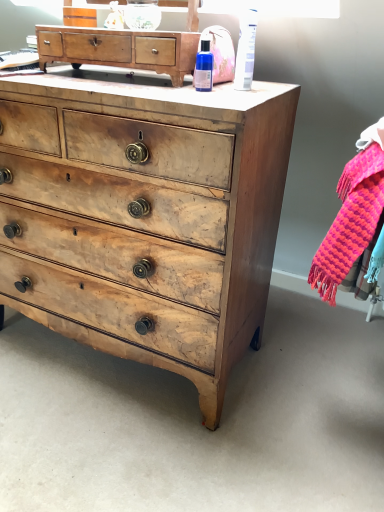
Image resolution: width=384 pixels, height=512 pixels. Find the location of `wooden chest of drawers at center, which is the 2th chest of drawers from top to bottom`. wooden chest of drawers at center, which is the 2th chest of drawers from top to bottom is located at coordinates (144, 217).

At what (x,y) coordinates should I click in order to perform the action: click on white plastic tube at upper right, arranged as the 2th toiletry when viewed from the left. Please return your answer as a coordinate pair (x, y). Looking at the image, I should click on (246, 50).

From the picture: Can you confirm if knitted wool scarf at right is thinner than white plastic tube at upper right, arranged as the 2th toiletry when viewed from the left?

Incorrect, the width of knitted wool scarf at right is not less than that of white plastic tube at upper right, arranged as the 2th toiletry when viewed from the left.

Does point (376, 179) come behind point (251, 35)?

No, it is not.

Is knitted wool scarf at right taller or shorter than white plastic tube at upper right, the first toiletry positioned from the right?

Clearly, knitted wool scarf at right is taller compared to white plastic tube at upper right, the first toiletry positioned from the right.

Is knitted wool scarf at right closer to the viewer compared to white plastic tube at upper right, arranged as the 2th toiletry when viewed from the left?

Yes, it is in front of white plastic tube at upper right, arranged as the 2th toiletry when viewed from the left.

From a real-world perspective, is blue glass bottle at upper center, which ranks as the 1th toiletry in left-to-right order, positioned over white plastic tube at upper right, the first toiletry positioned from the right, based on gravity?

Incorrect, from a real-world perspective, blue glass bottle at upper center, which ranks as the 1th toiletry in left-to-right order, is lower than white plastic tube at upper right, the first toiletry positioned from the right.

Could you tell me if blue glass bottle at upper center, which ranks as the 1th toiletry in left-to-right order, is turned towards white plastic tube at upper right, arranged as the 2th toiletry when viewed from the left?

No, blue glass bottle at upper center, which ranks as the 1th toiletry in left-to-right order, is not turned towards white plastic tube at upper right, arranged as the 2th toiletry when viewed from the left.

Is blue glass bottle at upper center, which ranks as the 1th toiletry in left-to-right order, not within white plastic tube at upper right, arranged as the 2th toiletry when viewed from the left?

Absolutely, blue glass bottle at upper center, which ranks as the 1th toiletry in left-to-right order, is external to white plastic tube at upper right, arranged as the 2th toiletry when viewed from the left.

Which of these two, knitted wool scarf at right or wooden chest of drawers at center, the 1th chest of drawers when ordered from bottom to top, is wider?

With larger width is wooden chest of drawers at center, the 1th chest of drawers when ordered from bottom to top.

Between point (369, 229) and point (114, 319), which one is positioned behind?

The point (114, 319) is farther from the camera.

You are a GUI agent. You are given a task and a screenshot of the screen. Output one action in this format:
    pyautogui.click(x=<x>, y=<y>)
    Task: Click on the clothing lying below the wooden chest of drawers at center, the 1th chest of drawers when ordered from bottom to top (from the image's perspective)
    The image size is (384, 512).
    Given the screenshot: What is the action you would take?
    pyautogui.click(x=350, y=221)

In terms of size, does knitted wool scarf at right appear bigger or smaller than wooden chest of drawers at center, which is the 2th chest of drawers from top to bottom?

In the image, knitted wool scarf at right appears to be smaller than wooden chest of drawers at center, which is the 2th chest of drawers from top to bottom.

Is wooden chest of drawers at upper center, the second chest of drawers from the bottom, beside white plastic tube at upper right, arranged as the 2th toiletry when viewed from the left?

No, wooden chest of drawers at upper center, the second chest of drawers from the bottom, is not in contact with white plastic tube at upper right, arranged as the 2th toiletry when viewed from the left.

Looking at their sizes, would you say wooden chest of drawers at upper center, which is counted as the first chest of drawers, starting from the top, is wider or thinner than white plastic tube at upper right, the first toiletry positioned from the right?

Clearly, wooden chest of drawers at upper center, which is counted as the first chest of drawers, starting from the top, has more width compared to white plastic tube at upper right, the first toiletry positioned from the right.

Between point (57, 28) and point (241, 86), which one is positioned behind?

Positioned behind is point (57, 28).

Can you confirm if knitted wool scarf at right is smaller than wooden chest of drawers at upper center, the second chest of drawers from the bottom?

Actually, knitted wool scarf at right might be larger than wooden chest of drawers at upper center, the second chest of drawers from the bottom.

Which object is thinner, knitted wool scarf at right or wooden chest of drawers at upper center, which is counted as the first chest of drawers, starting from the top?

With smaller width is wooden chest of drawers at upper center, which is counted as the first chest of drawers, starting from the top.

From the knitted wool scarf at right, count the 1st chest of drawers to the left and point to it. Please provide its 2D coordinates.

[(120, 49)]

From a real-world perspective, is wooden chest of drawers at center, the 1th chest of drawers when ordered from bottom to top, above or below blue glass bottle at upper center, which ranks as the 1th toiletry in left-to-right order?

wooden chest of drawers at center, the 1th chest of drawers when ordered from bottom to top, is below blue glass bottle at upper center, which ranks as the 1th toiletry in left-to-right order.

Which is behind, wooden chest of drawers at center, the 1th chest of drawers when ordered from bottom to top, or blue glass bottle at upper center, acting as the 2th toiletry starting from the right?

blue glass bottle at upper center, acting as the 2th toiletry starting from the right, is behind.

Looking at this image, is wooden chest of drawers at center, which is the 2th chest of drawers from top to bottom, positioned with its back to blue glass bottle at upper center, acting as the 2th toiletry starting from the right?

That's not correct — wooden chest of drawers at center, which is the 2th chest of drawers from top to bottom, is not looking away from blue glass bottle at upper center, acting as the 2th toiletry starting from the right.

In terms of height, does wooden chest of drawers at center, which is the 2th chest of drawers from top to bottom, look taller or shorter compared to blue glass bottle at upper center, which ranks as the 1th toiletry in left-to-right order?

wooden chest of drawers at center, which is the 2th chest of drawers from top to bottom, is taller than blue glass bottle at upper center, which ranks as the 1th toiletry in left-to-right order.

Is white plastic tube at upper right, arranged as the 2th toiletry when viewed from the left, inside or outside of blue glass bottle at upper center, acting as the 2th toiletry starting from the right?

white plastic tube at upper right, arranged as the 2th toiletry when viewed from the left, is spatially situated outside blue glass bottle at upper center, acting as the 2th toiletry starting from the right.

Based on the photo, can you confirm if white plastic tube at upper right, arranged as the 2th toiletry when viewed from the left, is smaller than blue glass bottle at upper center, which ranks as the 1th toiletry in left-to-right order?

No, white plastic tube at upper right, arranged as the 2th toiletry when viewed from the left, is not smaller than blue glass bottle at upper center, which ranks as the 1th toiletry in left-to-right order.

You are a GUI agent. You are given a task and a screenshot of the screen. Output one action in this format:
    pyautogui.click(x=<x>, y=<y>)
    Task: Click on the toiletry lying in front of the blue glass bottle at upper center, acting as the 2th toiletry starting from the right
    This screenshot has height=512, width=384.
    Given the screenshot: What is the action you would take?
    pyautogui.click(x=246, y=50)

At what (x,y) coordinates should I click in order to perform the action: click on clothing below the white plastic tube at upper right, arranged as the 2th toiletry when viewed from the left (from the image's perspective). Please return your answer as a coordinate pair (x, y). The image size is (384, 512). Looking at the image, I should click on (350, 221).

Image resolution: width=384 pixels, height=512 pixels. I want to click on toiletry behind the white plastic tube at upper right, arranged as the 2th toiletry when viewed from the left, so pyautogui.click(x=204, y=67).

Based on the photo, which object lies nearer to the anchor point wooden chest of drawers at upper center, which is counted as the first chest of drawers, starting from the top, knitted wool scarf at right or white plastic tube at upper right, the first toiletry positioned from the right?

white plastic tube at upper right, the first toiletry positioned from the right.

Estimate the real-world distances between objects in this image. Which object is closer to wooden chest of drawers at center, the 1th chest of drawers when ordered from bottom to top, knitted wool scarf at right or blue glass bottle at upper center, acting as the 2th toiletry starting from the right?

Based on the image, knitted wool scarf at right appears to be nearer to wooden chest of drawers at center, the 1th chest of drawers when ordered from bottom to top.

Estimate the real-world distances between objects in this image. Which object is closer to wooden chest of drawers at center, the 1th chest of drawers when ordered from bottom to top, blue glass bottle at upper center, which ranks as the 1th toiletry in left-to-right order, or wooden chest of drawers at upper center, which is counted as the first chest of drawers, starting from the top?

wooden chest of drawers at upper center, which is counted as the first chest of drawers, starting from the top.

Which object lies nearer to the anchor point white plastic tube at upper right, arranged as the 2th toiletry when viewed from the left, knitted wool scarf at right or blue glass bottle at upper center, acting as the 2th toiletry starting from the right?

The object closer to white plastic tube at upper right, arranged as the 2th toiletry when viewed from the left, is blue glass bottle at upper center, acting as the 2th toiletry starting from the right.

Based on the photo, estimate the real-world distances between objects in this image. Which object is closer to blue glass bottle at upper center, acting as the 2th toiletry starting from the right, wooden chest of drawers at center, the 1th chest of drawers when ordered from bottom to top, or knitted wool scarf at right?

wooden chest of drawers at center, the 1th chest of drawers when ordered from bottom to top, lies closer to blue glass bottle at upper center, acting as the 2th toiletry starting from the right, than the other object.

Which object lies nearer to the anchor point wooden chest of drawers at center, which is the 2th chest of drawers from top to bottom, wooden chest of drawers at upper center, the second chest of drawers from the bottom, or white plastic tube at upper right, the first toiletry positioned from the right?

wooden chest of drawers at upper center, the second chest of drawers from the bottom.

From the image, which object appears to be nearer to wooden chest of drawers at upper center, which is counted as the first chest of drawers, starting from the top, blue glass bottle at upper center, which ranks as the 1th toiletry in left-to-right order, or wooden chest of drawers at center, which is the 2th chest of drawers from top to bottom?

blue glass bottle at upper center, which ranks as the 1th toiletry in left-to-right order, is closer to wooden chest of drawers at upper center, which is counted as the first chest of drawers, starting from the top.

Considering their positions, is blue glass bottle at upper center, which ranks as the 1th toiletry in left-to-right order, positioned closer to white plastic tube at upper right, arranged as the 2th toiletry when viewed from the left, than wooden chest of drawers at center, the 1th chest of drawers when ordered from bottom to top?

blue glass bottle at upper center, which ranks as the 1th toiletry in left-to-right order, is closer to white plastic tube at upper right, arranged as the 2th toiletry when viewed from the left.

Where is `toiletry between white plastic tube at upper right, arranged as the 2th toiletry when viewed from the left, and wooden chest of drawers at center, the 1th chest of drawers when ordered from bottom to top, in the vertical direction`? This screenshot has height=512, width=384. toiletry between white plastic tube at upper right, arranged as the 2th toiletry when viewed from the left, and wooden chest of drawers at center, the 1th chest of drawers when ordered from bottom to top, in the vertical direction is located at coordinates (204, 67).

At what (x,y) coordinates should I click in order to perform the action: click on toiletry located between wooden chest of drawers at upper center, which is counted as the first chest of drawers, starting from the top, and white plastic tube at upper right, arranged as the 2th toiletry when viewed from the left, in the left-right direction. Please return your answer as a coordinate pair (x, y). The width and height of the screenshot is (384, 512). Looking at the image, I should click on (204, 67).

The image size is (384, 512). I want to click on toiletry that lies between white plastic tube at upper right, the first toiletry positioned from the right, and knitted wool scarf at right from top to bottom, so click(204, 67).

This screenshot has height=512, width=384. What are the coordinates of `chest of drawers between wooden chest of drawers at center, the 1th chest of drawers when ordered from bottom to top, and knitted wool scarf at right, in the horizontal direction` in the screenshot? It's located at [x=120, y=49].